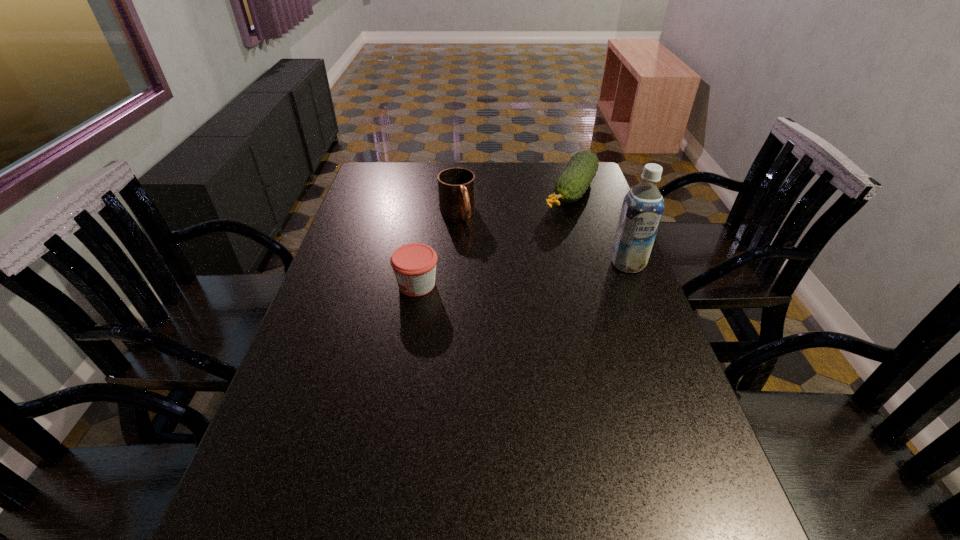
Where is `free point located at the blossom end of the cucumber`? free point located at the blossom end of the cucumber is located at coordinates (519, 275).

Where is `free spot located on the side of the mug with the handle`? The image size is (960, 540). free spot located on the side of the mug with the handle is located at coordinates (495, 287).

The height and width of the screenshot is (540, 960). Find the location of `vacant space located on the side of the mug with the handle`. vacant space located on the side of the mug with the handle is located at coordinates (484, 266).

This screenshot has height=540, width=960. I want to click on free space located on the side of the mug with the handle, so click(x=506, y=306).

Where is `object that is at the far edge`? The image size is (960, 540). object that is at the far edge is located at coordinates (572, 183).

Locate an element on the screen. Image resolution: width=960 pixels, height=540 pixels. soya milk present at the right edge is located at coordinates (643, 206).

You are a GUI agent. You are given a task and a screenshot of the screen. Output one action in this format:
    pyautogui.click(x=<x>, y=<y>)
    Task: Click on the cucumber located at the right edge
    The width and height of the screenshot is (960, 540).
    Given the screenshot: What is the action you would take?
    pyautogui.click(x=572, y=183)

Find the location of a particular element. object at the far right corner is located at coordinates (572, 183).

In order to click on vacant space at the far edge in this screenshot , I will do (x=472, y=166).

In the image, there is a desktop. At what (x,y) coordinates should I click in order to perform the action: click on vacant space at the near edge. Please return your answer as a coordinate pair (x, y). The image size is (960, 540). Looking at the image, I should click on (343, 469).